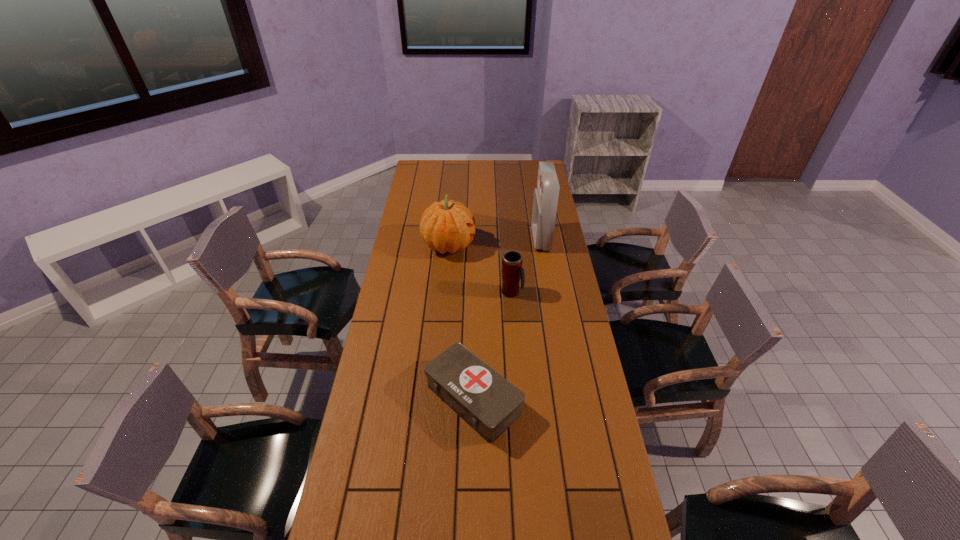
The image size is (960, 540). Identify the location of vacant region located on the carved face of the third shortest object. (512, 245).

Locate an element on the screen. This screenshot has width=960, height=540. vacant region located 0.200m on the side with the handle of the thermos bottle is located at coordinates (571, 292).

Identify the location of free space located 0.160m on the back of the shorter first-aid kit. The height and width of the screenshot is (540, 960). (474, 326).

Find the location of a particular element. The image size is (960, 540). object present at the left edge is located at coordinates (445, 226).

This screenshot has height=540, width=960. Find the location of `object situated at the right edge`. object situated at the right edge is located at coordinates (545, 201).

The image size is (960, 540). Find the location of `free space at the far edge`. free space at the far edge is located at coordinates (447, 171).

Where is `free region at the left edge of the desktop`? free region at the left edge of the desktop is located at coordinates (398, 362).

Locate an element on the screen. This screenshot has width=960, height=540. vacant area at the right edge of the desktop is located at coordinates coord(563,355).

Where is `vacant region between the thermos bottle and the second tallest object`? The width and height of the screenshot is (960, 540). vacant region between the thermos bottle and the second tallest object is located at coordinates (480, 269).

You are a GUI agent. You are given a task and a screenshot of the screen. Output one action in this format:
    pyautogui.click(x=<x>, y=<y>)
    Task: Click on the free spot between the second tallest object and the shorter first-aid kit
    
    Given the screenshot: What is the action you would take?
    pyautogui.click(x=461, y=322)